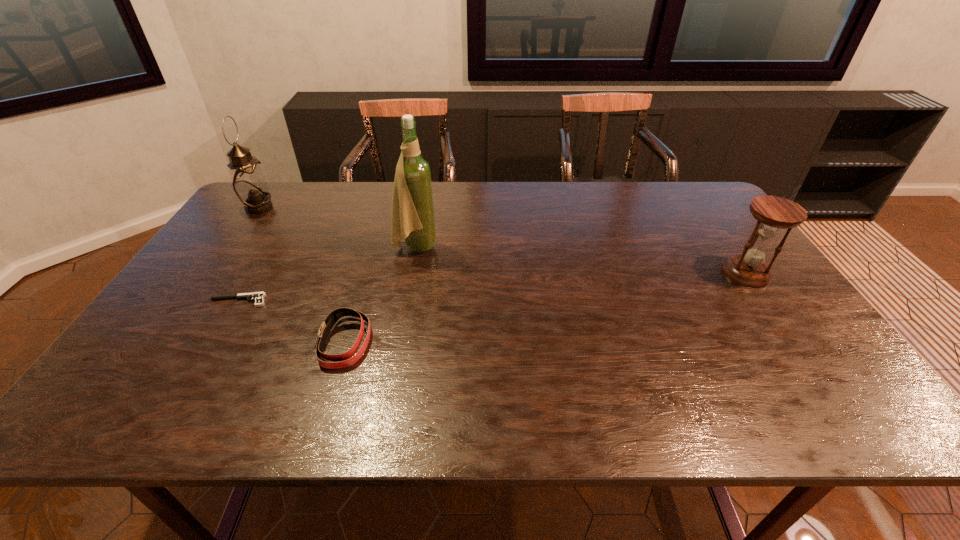
Find the location of `free area in between the wine bottle and the fourth tallest object`. free area in between the wine bottle and the fourth tallest object is located at coordinates (380, 294).

Find the location of `vacant space in between the oil lamp and the hourglass`. vacant space in between the oil lamp and the hourglass is located at coordinates (503, 240).

Where is `free spot between the fourth farthest object and the second shortest object`? free spot between the fourth farthest object and the second shortest object is located at coordinates (292, 321).

Locate an element on the screen. The height and width of the screenshot is (540, 960). free space between the farthest object and the pistol is located at coordinates (249, 254).

In order to click on free space between the second tallest object and the hourglass in this screenshot , I will do `click(503, 240)`.

Find the location of `unoccupied area between the pistol and the farthest object`. unoccupied area between the pistol and the farthest object is located at coordinates (249, 254).

This screenshot has width=960, height=540. Find the location of `vacant space that's between the second object from right to left and the second tallest object`. vacant space that's between the second object from right to left and the second tallest object is located at coordinates (337, 227).

At what (x,y) coordinates should I click in order to perform the action: click on the closest object to the fourth farthest object. Please return your answer as a coordinate pair (x, y). The height and width of the screenshot is (540, 960). Looking at the image, I should click on (346, 359).

Select which object appears as the third closest to the rightmost object. Please provide its 2D coordinates. Your answer should be formatted as a tuple, i.e. [(x, y)], where the tuple contains the x and y coordinates of a point satisfying the conditions above.

[(258, 297)]

Find the location of a particular element. The width and height of the screenshot is (960, 540). free region that satisfies the following two spatial constraints: 1. on the front-facing side of the tallest object; 2. on the left side of the rightmost object is located at coordinates (411, 273).